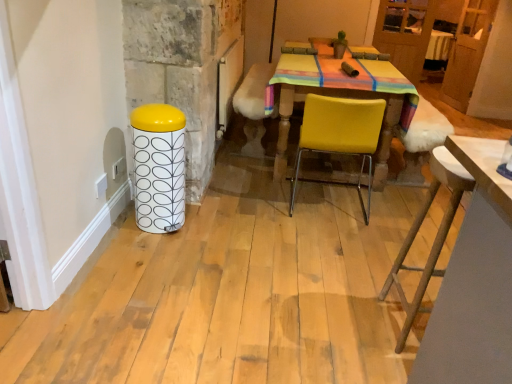
Locate an element on the screen. The image size is (512, 384). vacant space to the left of wooden table at lower right is located at coordinates (349, 321).